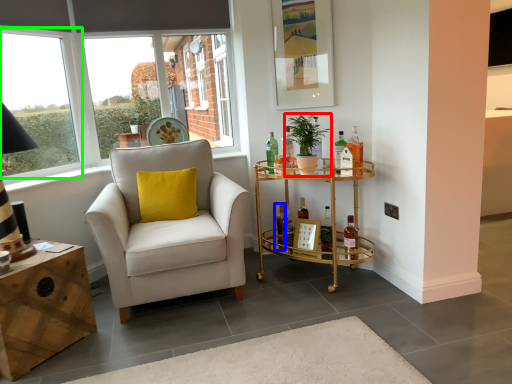
Question: Estimate the real-world distances between objects in this image. Which object is farther from houseplant (highlighted by a red box), bottle (highlighted by a blue box) or window (highlighted by a green box)?

Choices:
 (A) bottle
 (B) window

Answer: (B)